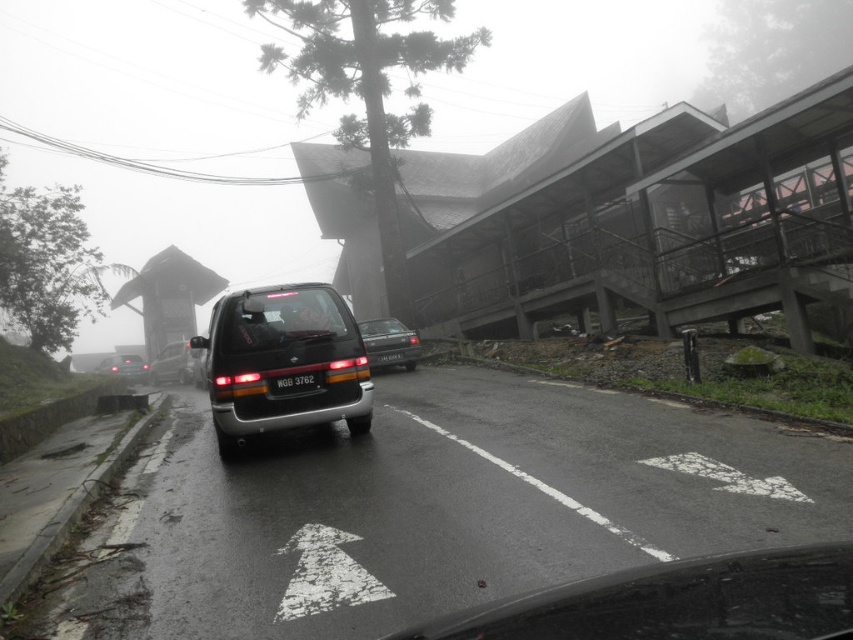
Question: Is satin silver sedan at center to the left of black matte license plate at center from the viewer's perspective?

Choices:
 (A) no
 (B) yes

Answer: (A)

Question: Is transparent glass windshield at center wider than satin silver sedan at center?

Choices:
 (A) no
 (B) yes

Answer: (B)

Question: Which is farther from the satin silver sedan at center?

Choices:
 (A) black plastic license plate at center
 (B) satin black van at center

Answer: (B)

Question: Which object is farther from the camera taking this photo?

Choices:
 (A) transparent glass windshield at center
 (B) matte black van at left
 (C) satin silver sedan at center
 (D) black matte license plate at center

Answer: (B)

Question: Does satin black van at center appear under black plastic license plate at center?

Choices:
 (A) no
 (B) yes

Answer: (A)

Question: Which point is closer to the camera?

Choices:
 (A) (393, 317)
 (B) (136, 358)

Answer: (A)